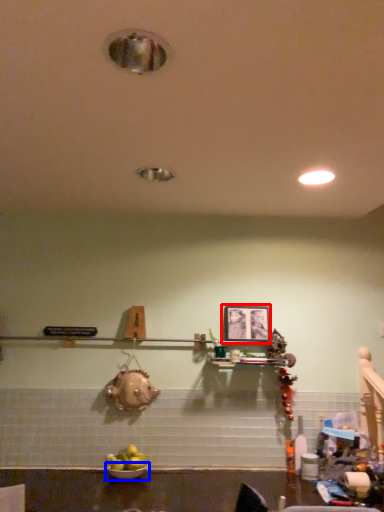
Question: Which object is closer to the camera taking this photo, picture frame (highlighted by a red box) or bowl (highlighted by a blue box)?

Choices:
 (A) picture frame
 (B) bowl

Answer: (B)